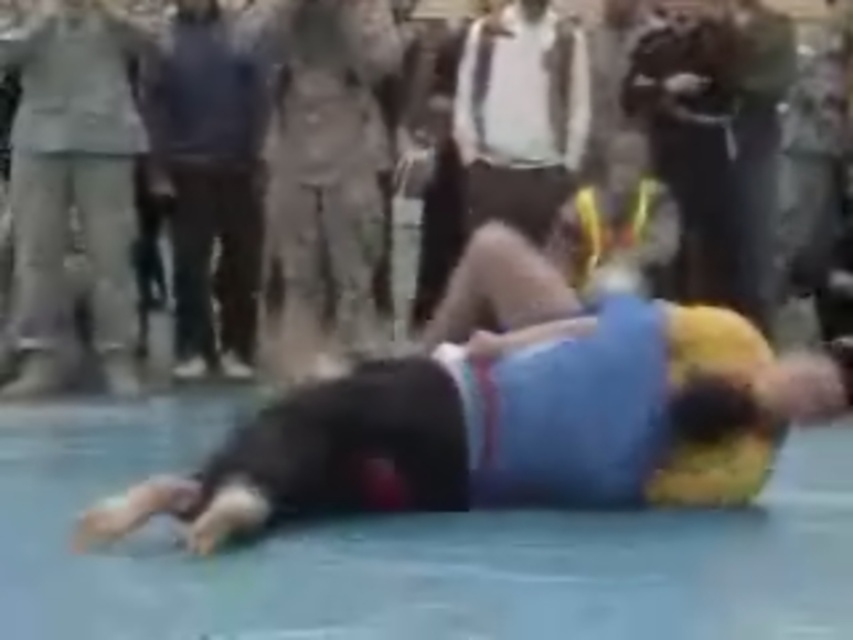
Image resolution: width=853 pixels, height=640 pixels. I want to click on matte gray suit at upper left, so click(x=546, y=148).

Is point (837, 118) less distant than point (73, 104)?

No.

At what (x,y) coordinates should I click in order to perform the action: click on matte gray suit at upper left. Please return your answer as a coordinate pair (x, y). Looking at the image, I should click on (546, 148).

What do you see at coordinates (508, 413) in the screenshot?
I see `blue fabric wrestler at center` at bounding box center [508, 413].

Can you confirm if blue fabric wrestler at center is positioned to the left of gray suit at left?

In fact, blue fabric wrestler at center is to the right of gray suit at left.

Which is in front, point (672, 396) or point (33, 109)?

Point (672, 396) is more forward.

Locate an element on the screen. This screenshot has width=853, height=640. blue fabric wrestler at center is located at coordinates (508, 413).

Who is more distant from viewer, (560, 492) or (257, 92)?

The point (257, 92) is more distant.

Who is shorter, blue fabric wrestler at center or dark blue shirt at center?

blue fabric wrestler at center

Is point (576, 355) farther from camera compared to point (215, 102)?

No, (576, 355) is closer to viewer.

The image size is (853, 640). Identify the location of blue fabric wrestler at center. (508, 413).